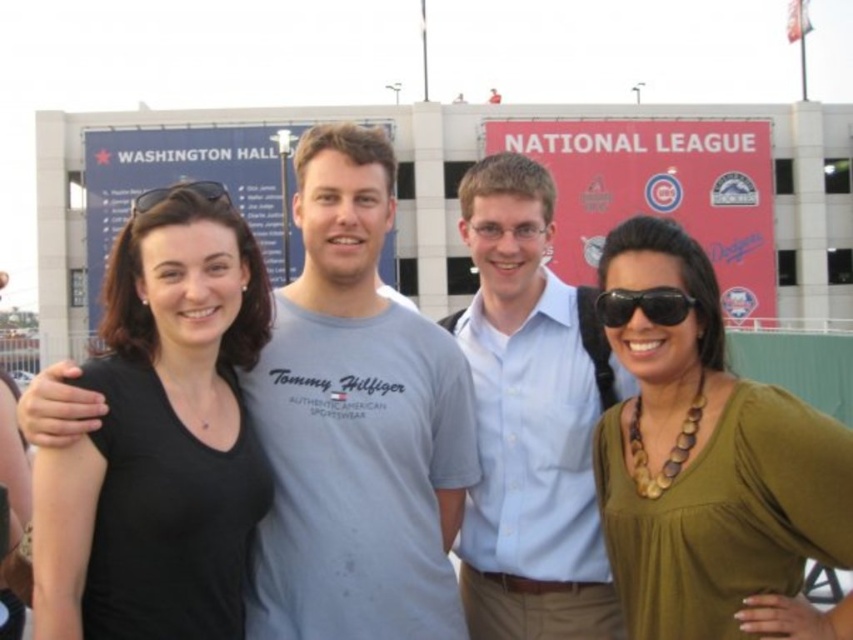
Question: Which object appears farthest from the camera in this image?

Choices:
 (A) light gray cotton t-shirt at center
 (B) black plastic sunglasses at lower right
 (C) green fabric shirt at right
 (D) matte black sunglasses at left

Answer: (D)

Question: Is light gray cotton t-shirt at center smaller than green fabric shirt at right?

Choices:
 (A) no
 (B) yes

Answer: (A)

Question: Considering the relative positions of black matte shirt at center and green fabric shirt at right in the image provided, where is black matte shirt at center located with respect to green fabric shirt at right?

Choices:
 (A) left
 (B) right

Answer: (A)

Question: Is black matte shirt at center to the right of light blue shirt at center from the viewer's perspective?

Choices:
 (A) no
 (B) yes

Answer: (A)

Question: Which point is closer to the camera taking this photo?

Choices:
 (A) (144, 420)
 (B) (692, 250)
 (C) (137, 212)

Answer: (A)

Question: Which object is closer to the camera taking this photo?

Choices:
 (A) green fabric shirt at right
 (B) black plastic sunglasses at lower right

Answer: (A)